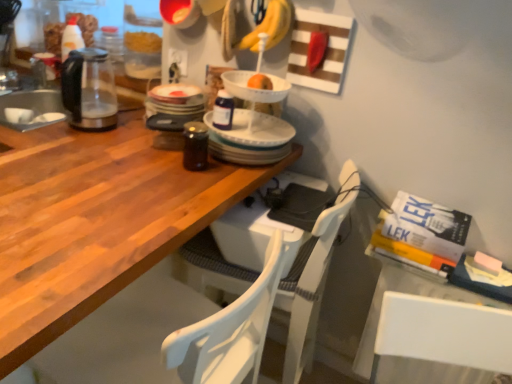
Measure the distance between wooden table at center and camera.

The depth of wooden table at center is 24.17 inches.

The width and height of the screenshot is (512, 384). What do you see at coordinates (71, 96) in the screenshot?
I see `transparent glass kettle at left` at bounding box center [71, 96].

Where is `wooden table at center`? wooden table at center is located at coordinates (94, 221).

Is transparent glass kettle at left in contact with white plastic chair at center, acting as the second chair starting from the front?

No, transparent glass kettle at left is not next to white plastic chair at center, acting as the second chair starting from the front.

Looking at this image, which is behind, transparent glass kettle at left or white plastic chair at center, which ranks as the first chair in back-to-front order?

transparent glass kettle at left.

Based on the photo, could you tell me if transparent glass kettle at left is turned towards white plastic chair at center, acting as the second chair starting from the front?

No, transparent glass kettle at left is not turned towards white plastic chair at center, acting as the second chair starting from the front.

Identify the location of sink below the yellow matte bananas at upper center (from a real-world perspective). Image resolution: width=512 pixels, height=384 pixels. (71, 96).

Is transparent glass kettle at left positioned beyond the bounds of yellow matte bananas at upper center?

Indeed, transparent glass kettle at left is completely outside yellow matte bananas at upper center.

Visually, is transparent glass kettle at left positioned to the left or to the right of yellow matte bananas at upper center?

Clearly, transparent glass kettle at left is on the left of yellow matte bananas at upper center in the image.

Looking at this image, is transparent glass kettle at left in front of or behind yellow matte bananas at upper center in the image?

transparent glass kettle at left is positioned closer to the viewer than yellow matte bananas at upper center.

Which is in front, point (155, 223) or point (91, 94)?

Point (155, 223)

Based on the photo, between wooden table at center and transparent glass kettle at left, which one is positioned behind?

transparent glass kettle at left is further from the camera.

In terms of width, does wooden table at center look wider or thinner when compared to transparent glass kettle at left?

In the image, wooden table at center appears to be wider than transparent glass kettle at left.

Is transparent glass kettle at left a part of wooden table at center?

Actually, transparent glass kettle at left is outside wooden table at center.

Measure the distance between wooden table at center and white wood chair at lower left, the 1th chair in the front-to-back sequence.

wooden table at center and white wood chair at lower left, the 1th chair in the front-to-back sequence, are 11.76 inches apart.

Looking at their sizes, would you say wooden table at center is wider or thinner than white wood chair at lower left, the 1th chair in the front-to-back sequence?

In the image, wooden table at center appears to be wider than white wood chair at lower left, the 1th chair in the front-to-back sequence.

Can we say wooden table at center lies outside white wood chair at lower left, acting as the second chair starting from the back?

wooden table at center lies outside white wood chair at lower left, acting as the second chair starting from the back,'s area.

Which is in front, white wood chair at lower left, acting as the second chair starting from the back, or transparent glass kettle at left?

white wood chair at lower left, acting as the second chair starting from the back, is in front.

Is white wood chair at lower left, the 1th chair in the front-to-back sequence, to the left of transparent glass kettle at left from the viewer's perspective?

In fact, white wood chair at lower left, the 1th chair in the front-to-back sequence, is to the right of transparent glass kettle at left.

Could you measure the distance between white wood chair at lower left, the 1th chair in the front-to-back sequence, and transparent glass kettle at left?

white wood chair at lower left, the 1th chair in the front-to-back sequence, and transparent glass kettle at left are 28.21 inches apart from each other.

Is white wood chair at lower left, acting as the second chair starting from the back, taller than transparent glass kettle at left?

Indeed, white wood chair at lower left, acting as the second chair starting from the back, has a greater height compared to transparent glass kettle at left.

Is white plastic chair at center, which ranks as the first chair in back-to-front order, completely or partially inside yellow matte bananas at upper center?

Actually, white plastic chair at center, which ranks as the first chair in back-to-front order, is outside yellow matte bananas at upper center.

Locate an element on the screen. chair on the right of yellow matte bananas at upper center is located at coordinates (308, 291).

Is yellow matte bananas at upper center wider or thinner than white plastic chair at center, which ranks as the first chair in back-to-front order?

In the image, yellow matte bananas at upper center appears to be more narrow than white plastic chair at center, which ranks as the first chair in back-to-front order.

Looking at this image, what's the angular difference between yellow matte bananas at upper center and white plastic chair at center, acting as the second chair starting from the front,'s facing directions?

yellow matte bananas at upper center and white plastic chair at center, acting as the second chair starting from the front, are facing 89 degrees away from each other.

Can you confirm if white wood chair at lower left, the 1th chair in the front-to-back sequence, is smaller than yellow matte bananas at upper center?

No.

Visually, is white wood chair at lower left, the 1th chair in the front-to-back sequence, positioned to the left or to the right of yellow matte bananas at upper center?

Based on their positions, white wood chair at lower left, the 1th chair in the front-to-back sequence, is located to the left of yellow matte bananas at upper center.

Is white wood chair at lower left, acting as the second chair starting from the back, taller or shorter than yellow matte bananas at upper center?

In the image, white wood chair at lower left, acting as the second chair starting from the back, appears to be taller than yellow matte bananas at upper center.

Find the location of a particular element. Image resolution: width=512 pixels, height=384 pixels. the 2nd chair positioned below the transparent glass kettle at left (from a real-world perspective) is located at coordinates (308, 291).

The width and height of the screenshot is (512, 384). Find the location of `banana above the transparent glass kettle at left (from the image's perspective)`. banana above the transparent glass kettle at left (from the image's perspective) is located at coordinates (270, 26).

Considering their positions, is wooden table at center positioned further to white plastic chair at center, which ranks as the first chair in back-to-front order, than yellow matte bananas at upper center?

The object further to white plastic chair at center, which ranks as the first chair in back-to-front order, is yellow matte bananas at upper center.

Considering their positions, is white wood chair at lower left, acting as the second chair starting from the back, positioned closer to white plastic chair at center, which ranks as the first chair in back-to-front order, than wooden table at center?

Among the two, white wood chair at lower left, acting as the second chair starting from the back, is located nearer to white plastic chair at center, which ranks as the first chair in back-to-front order.

Based on their spatial positions, is white plastic chair at center, acting as the second chair starting from the front, or transparent glass kettle at left closer to white wood chair at lower left, the 1th chair in the front-to-back sequence?

white plastic chair at center, acting as the second chair starting from the front, is positioned closer to the anchor white wood chair at lower left, the 1th chair in the front-to-back sequence.

When comparing their distances from yellow matte bananas at upper center, does white plastic chair at center, which ranks as the first chair in back-to-front order, or wooden table at center seem further?

The object further to yellow matte bananas at upper center is white plastic chair at center, which ranks as the first chair in back-to-front order.

Considering their positions, is yellow matte bananas at upper center positioned closer to white plastic chair at center, acting as the second chair starting from the front, than white wood chair at lower left, acting as the second chair starting from the back?

white wood chair at lower left, acting as the second chair starting from the back, is closer to white plastic chair at center, acting as the second chair starting from the front.

Looking at the image, which one is located closer to white wood chair at lower left, acting as the second chair starting from the back, yellow matte bananas at upper center or wooden table at center?

wooden table at center lies closer to white wood chair at lower left, acting as the second chair starting from the back, than the other object.

Based on their spatial positions, is white wood chair at lower left, the 1th chair in the front-to-back sequence, or yellow matte bananas at upper center further from white plastic chair at center, acting as the second chair starting from the front?

The object further to white plastic chair at center, acting as the second chair starting from the front, is yellow matte bananas at upper center.

Looking at the image, which one is located closer to wooden table at center, white wood chair at lower left, the 1th chair in the front-to-back sequence, or transparent glass kettle at left?

white wood chair at lower left, the 1th chair in the front-to-back sequence.

Image resolution: width=512 pixels, height=384 pixels. Find the location of `desk between yellow matte bananas at upper center and white wood chair at lower left, acting as the second chair starting from the back, vertically`. desk between yellow matte bananas at upper center and white wood chair at lower left, acting as the second chair starting from the back, vertically is located at coordinates (94, 221).

The height and width of the screenshot is (384, 512). Identify the location of chair between transparent glass kettle at left and white wood chair at lower left, acting as the second chair starting from the back, in the vertical direction. (308, 291).

Image resolution: width=512 pixels, height=384 pixels. Identify the location of chair between yellow matte bananas at upper center and white wood chair at lower left, the 1th chair in the front-to-back sequence, in the up-down direction. (308, 291).

Identify the location of desk between transparent glass kettle at left and white plastic chair at center, acting as the second chair starting from the front, in the vertical direction. (94, 221).